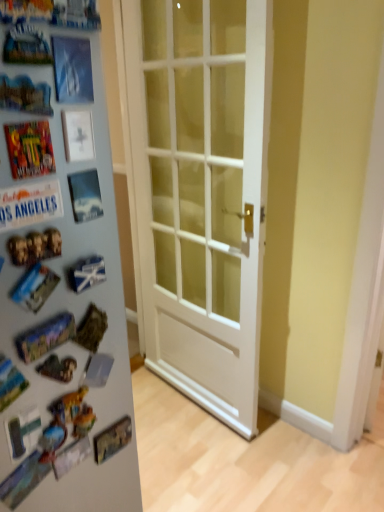
Locate an element on the screen. free point behind white glossy door at center is located at coordinates (195, 425).